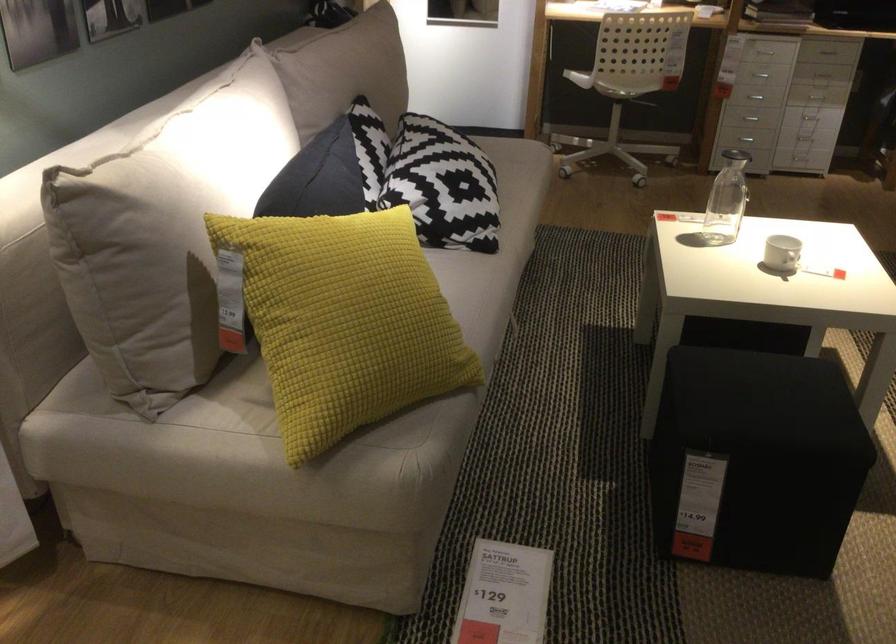
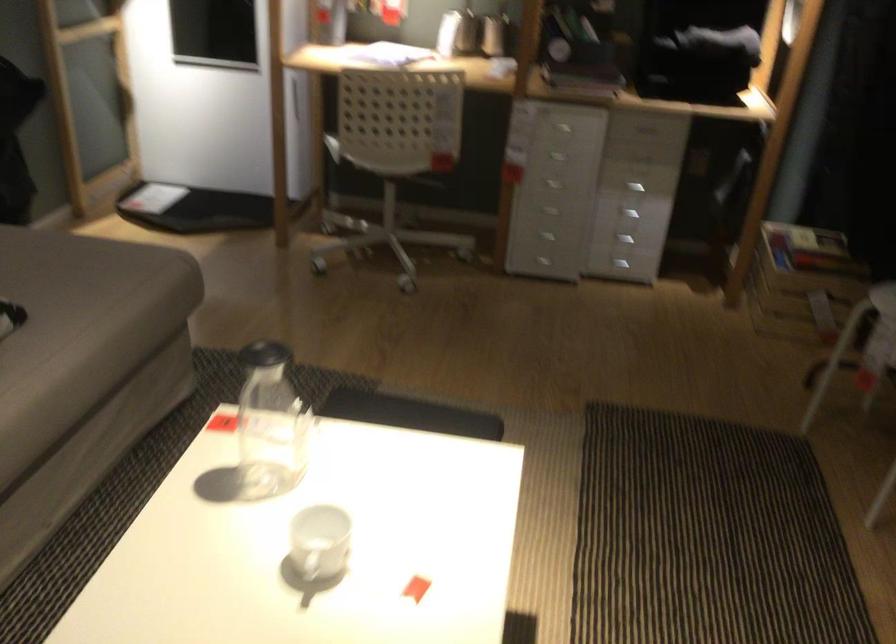
Locate, in the second image, the point that corresponds to point 778,261 in the first image.

(320, 542)